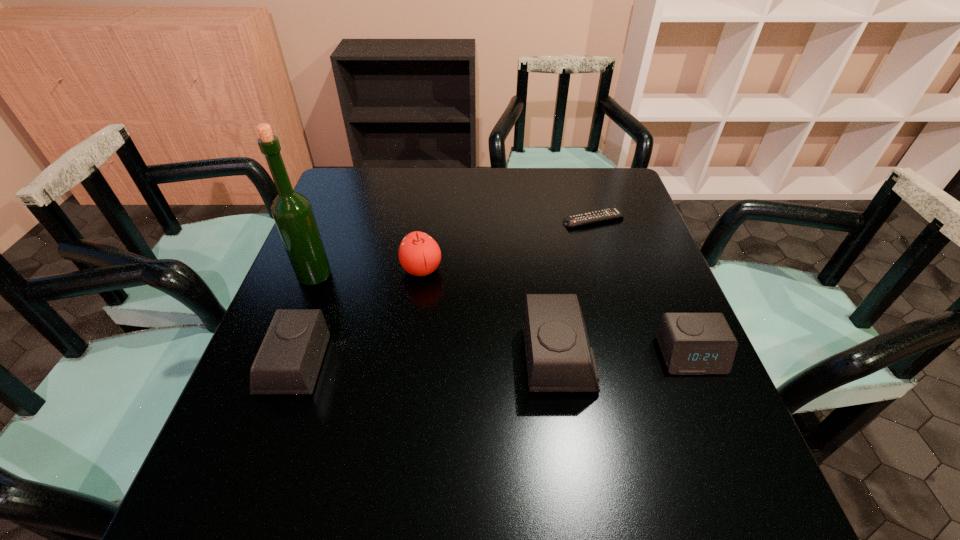
This screenshot has height=540, width=960. I want to click on vacant position for inserting another alarm_clock evenly, so click(427, 362).